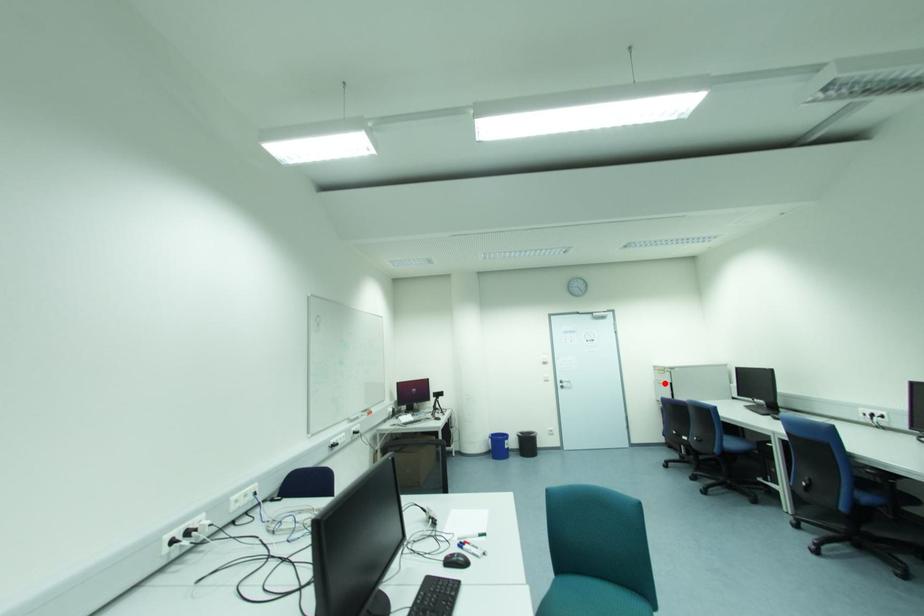
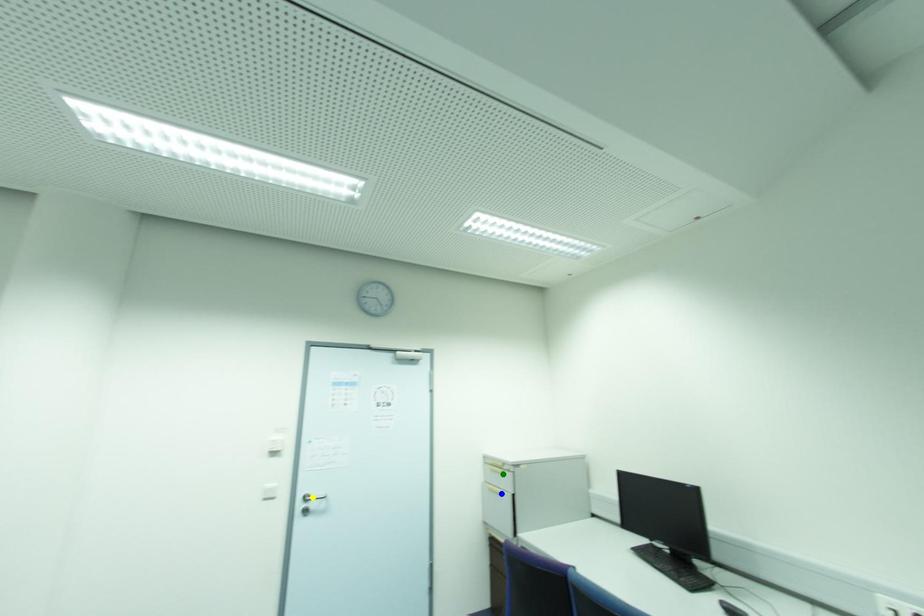
Question: I am providing you with two images of the same scene from different viewpoints. A red point is marked on the first image. You are given multiple points on the second image. Which spot in image 2 lines up with the point in image 1?

Choices:
 (A) yellow point
 (B) blue point
 (C) green point

Answer: (B)